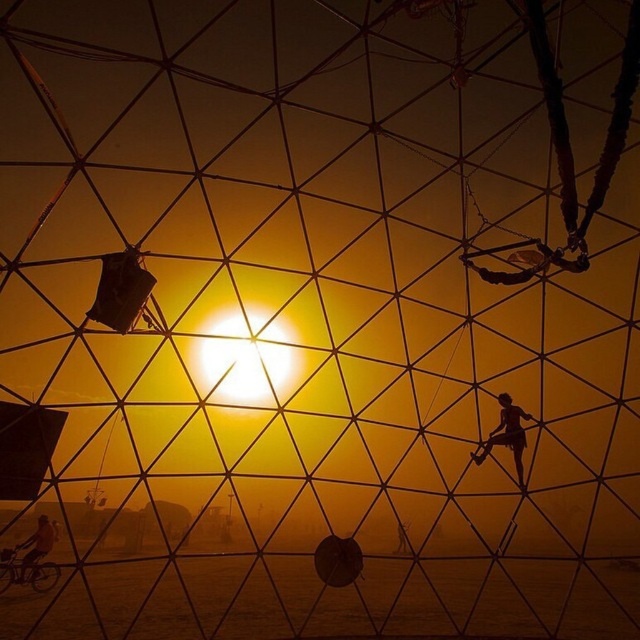
Looking at this image, between matte black figure at center and metallic bicycle at lower left, which one appears on the right side from the viewer's perspective?

matte black figure at center is more to the right.

What do you see at coordinates (506, 435) in the screenshot?
I see `matte black figure at center` at bounding box center [506, 435].

This screenshot has width=640, height=640. What are the coordinates of `matte black figure at center` in the screenshot? It's located at (506, 435).